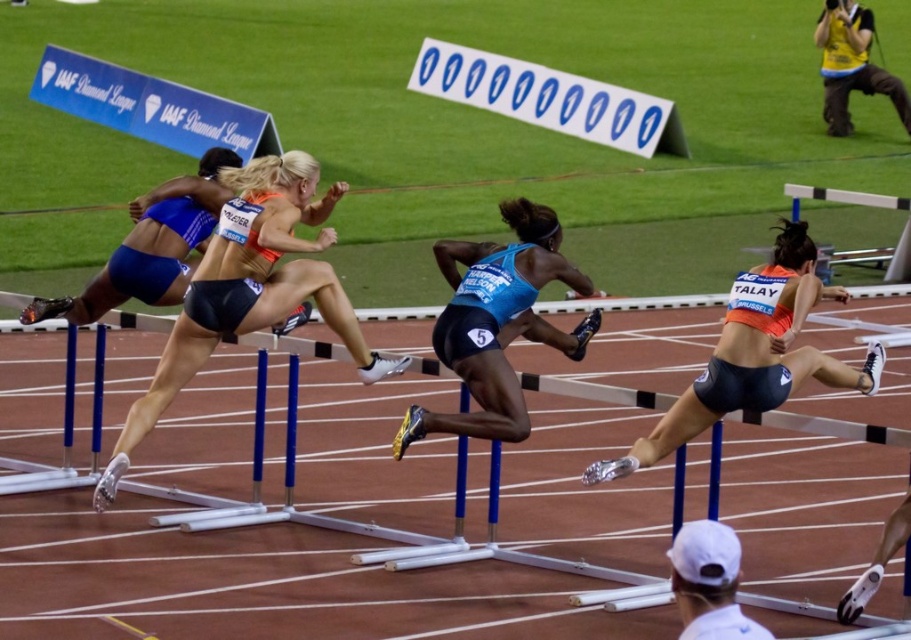
You are a photographer positioned at the edge of the track, and you want to capture a closeup of the blue matte running shorts at center and the white plastic finish line at upper center in the same frame. Which object will appear bigger in your photo?

The blue matte running shorts at center will appear bigger in the photo because it is larger in size than the white plastic finish line at upper center.

You are a photographer positioned at the edge of the infield. You notice the blue matte running shorts at center and the white plastic finish line at upper center in your camera viewfinder. Which object appears taller in the photo?

The blue matte running shorts at center appears taller than the white plastic finish line at upper center in the photo because the blue matte running shorts at center has a greater height compared to the white plastic finish line at upper center according to the description.

You are a photographer at the track event and need to capture a closeup of the blue matte running shorts at center and orange matte shorts at right. Which athlete should you zoom in on more to get a clear shot?

The blue matte running shorts at center is smaller than orange matte shorts at right, so you should zoom in more on the orange matte shorts at right to get a clear shot.